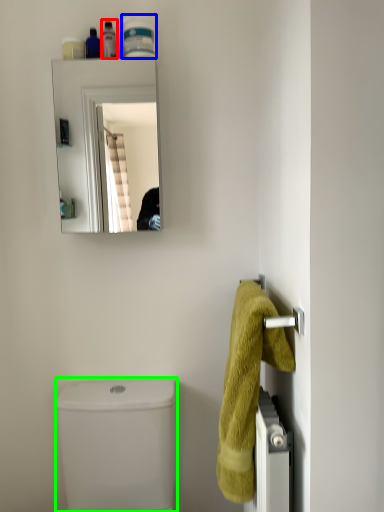
Question: Based on their relative distances, which object is farther from toiletry (highlighted by a red box)? Choose from toiletry (highlighted by a blue box) and toilet bowl (highlighted by a green box).

Choices:
 (A) toiletry
 (B) toilet bowl

Answer: (B)